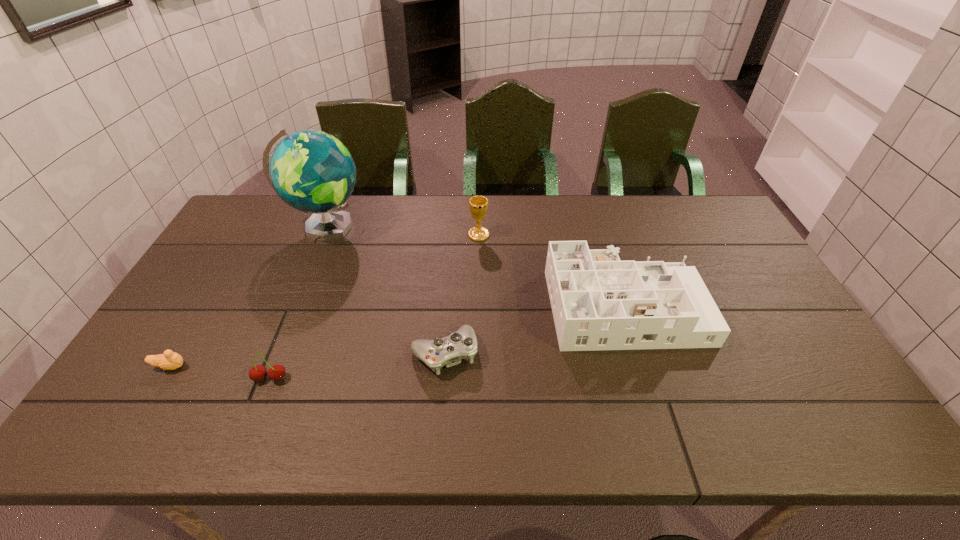
Identify the location of object that can be found as the third closest to the fourth tallest object. This screenshot has width=960, height=540. (312, 171).

Locate which object ranks fourth in proximity to the tallest object. Please provide its 2D coordinates. Your answer should be formatted as a tuple, i.e. [(x, y)], where the tuple contains the x and y coordinates of a point satisfying the conditions above.

[(276, 372)]

Find the location of a particular element. The height and width of the screenshot is (540, 960). vacant space that satisfies the following two spatial constraints: 1. on the front surface of the globe; 2. on the left side of the control is located at coordinates (274, 353).